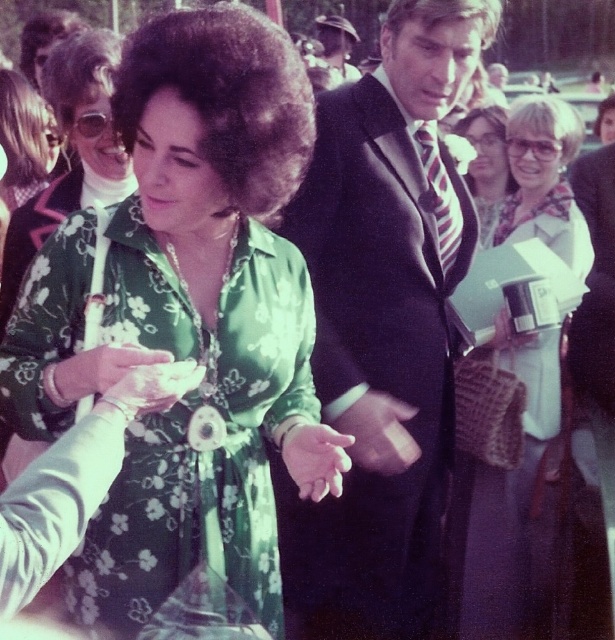
Based on the photo, is dark suit at center below floral fabric dress at center?

Correct, dark suit at center is located below floral fabric dress at center.

What do you see at coordinates (383, 326) in the screenshot?
I see `dark suit at center` at bounding box center [383, 326].

Locate an element on the screen. The width and height of the screenshot is (615, 640). dark suit at center is located at coordinates (x=383, y=326).

Between green floral fabric dress at center and matte black hair at upper right, which one has less height?

matte black hair at upper right

Can you confirm if green floral fabric dress at center is positioned to the right of matte black hair at upper right?

No, green floral fabric dress at center is not to the right of matte black hair at upper right.

Between point (132, 493) and point (493, 104), which one is positioned in front?

Point (132, 493) is more forward.

Locate an element on the screen. green floral fabric dress at center is located at coordinates (188, 422).

Between green floral fabric dress at center and matte black suit at upper center, which one appears on the left side from the viewer's perspective?

green floral fabric dress at center is more to the left.

Does green floral fabric dress at center have a lesser height compared to matte black suit at upper center?

No, green floral fabric dress at center is not shorter than matte black suit at upper center.

In the scene shown: Who is more distant from viewer, [292,353] or [354,74]?

Point [354,74]

At what (x,y) coordinates should I click in order to perform the action: click on green floral fabric dress at center. Please return your answer as a coordinate pair (x, y). The height and width of the screenshot is (640, 615). Looking at the image, I should click on (188, 422).